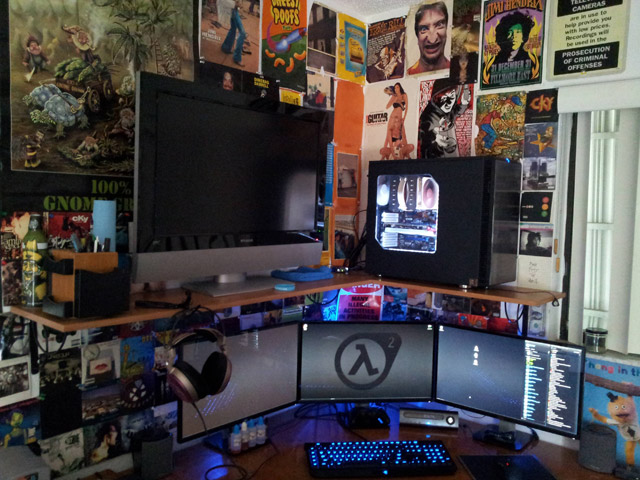
This screenshot has height=480, width=640. I want to click on black keyboard, so 342,466.